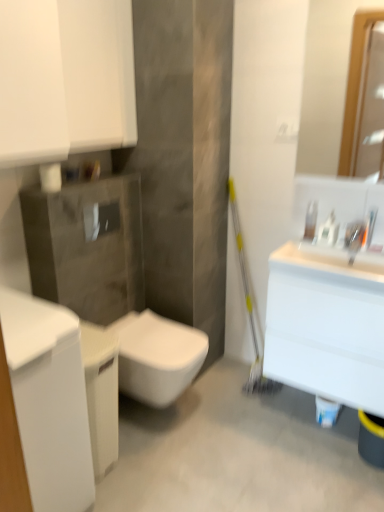
Question: Relative to clear plastic soap dispenser at upper right, is white glossy toilet at center in front or behind?

Choices:
 (A) front
 (B) behind

Answer: (A)

Question: In terms of height, does white glossy toilet at center look taller or shorter compared to clear plastic soap dispenser at upper right?

Choices:
 (A) short
 (B) tall

Answer: (B)

Question: Considering the real-world distances, which object is closest to the white glossy cabinet at upper left?

Choices:
 (A) white glossy bottle at upper right
 (B) white glossy sink at right
 (C) satin nickel faucet at upper right
 (D) white glossy cabinet at left
 (E) white glossy toilet at center

Answer: (D)

Question: Considering the real-world distances, which object is farthest from the white glossy cabinet at upper left?

Choices:
 (A) white glossy cabinet at left
 (B) white glossy toilet at center
 (C) matte wooden mirror at upper right
 (D) white glossy sink at upper right
 (E) clear plastic soap dispenser at upper right

Answer: (C)